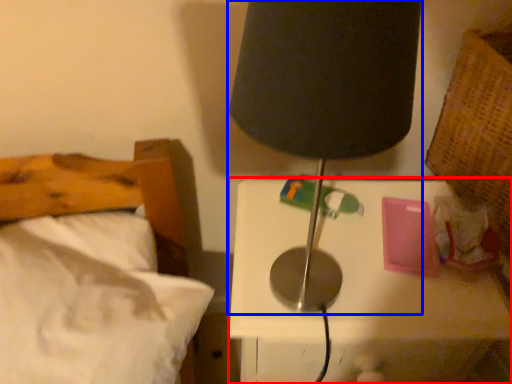
Question: Among these objects, which one is nearest to the camera, nightstand (highlighted by a red box) or lamp (highlighted by a blue box)?

Choices:
 (A) nightstand
 (B) lamp

Answer: (B)